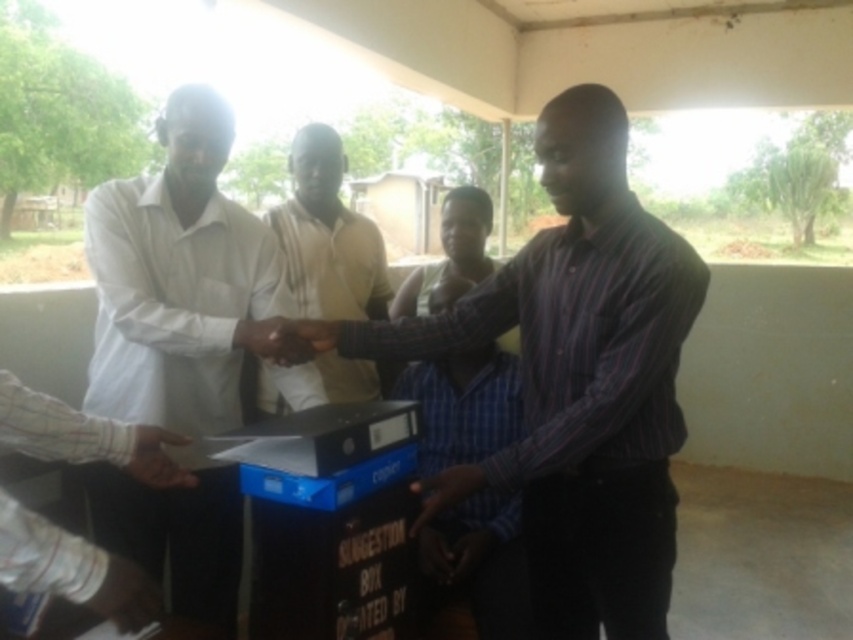
Question: Which point is farther to the camera?

Choices:
 (A) (546, 163)
 (B) (144, 467)
 (C) (224, 397)
 (D) (152, 608)

Answer: (C)

Question: Is matte black shirt at center bigger than light brown fabric shirt at center?

Choices:
 (A) yes
 (B) no

Answer: (B)

Question: Which object is farther from the camera taking this photo?

Choices:
 (A) matte brown hand at center
 (B) white matte shirt at upper left

Answer: (B)

Question: Can you confirm if white matte shirt at upper left is bigger than blue plaid shirt at center?

Choices:
 (A) yes
 (B) no

Answer: (B)

Question: Is matte black hand at lower left below white matte hand at center?

Choices:
 (A) yes
 (B) no

Answer: (A)

Question: Among these points, which one is farthest from the camera?

Choices:
 (A) (451, 492)
 (B) (158, 464)
 (C) (158, 604)
 (D) (193, 264)

Answer: (D)